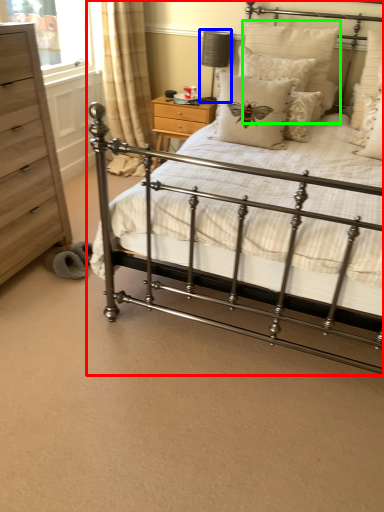
Question: Based on their relative distances, which object is nearer to bed (highlighted by a red box)? Choose from table lamp (highlighted by a blue box) and pillow (highlighted by a green box).

Choices:
 (A) table lamp
 (B) pillow

Answer: (B)